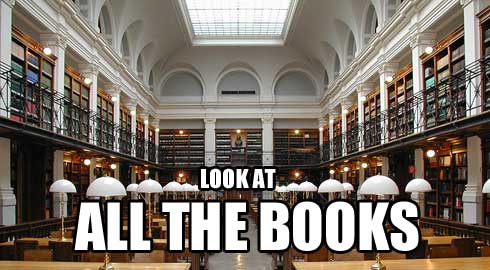
Identify the location of long brown tables. (60, 264), (450, 267), (439, 234).